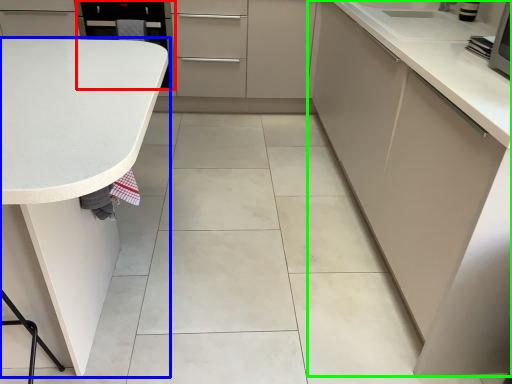
Question: Based on their relative distances, which object is farther from appliance (highlighted by a red box)? Choose from countertop (highlighted by a blue box) and cabinetry (highlighted by a green box).

Choices:
 (A) countertop
 (B) cabinetry

Answer: (B)